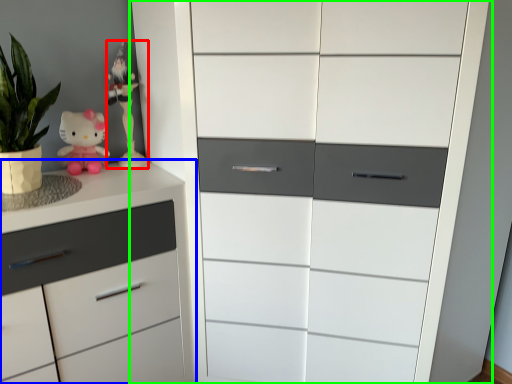
Question: Based on their relative distances, which object is nearer to miniature (highlighted by a red box)? Choose from chest of drawers (highlighted by a blue box) and chest of drawers (highlighted by a green box).

Choices:
 (A) chest of drawers
 (B) chest of drawers

Answer: (A)